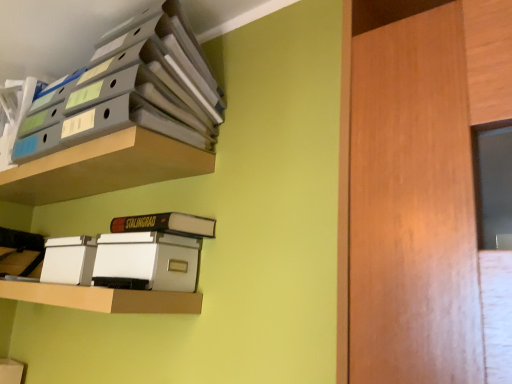
Question: From a real-world perspective, is matte plastic shelf at upper left, the 2th shelf viewed from the top, positioned under matte gray folders at upper left, the 1th shelf in the top-to-bottom sequence, based on gravity?

Choices:
 (A) no
 (B) yes

Answer: (B)

Question: Is matte plastic shelf at upper left, the 2th shelf viewed from the top, thinner than matte gray folders at upper left, the 1th shelf in the top-to-bottom sequence?

Choices:
 (A) yes
 (B) no

Answer: (A)

Question: Considering the relative positions of matte plastic shelf at upper left, which ranks as the second shelf in bottom-to-top order, and matte gray folders at upper left, the third shelf from the bottom, in the image provided, is matte plastic shelf at upper left, which ranks as the second shelf in bottom-to-top order, to the right of matte gray folders at upper left, the third shelf from the bottom, from the viewer's perspective?

Choices:
 (A) yes
 (B) no

Answer: (B)

Question: Is matte plastic shelf at upper left, the 2th shelf viewed from the top, to the left of matte gray folders at upper left, the 1th shelf in the top-to-bottom sequence, from the viewer's perspective?

Choices:
 (A) yes
 (B) no

Answer: (A)

Question: Is matte plastic shelf at upper left, which ranks as the second shelf in bottom-to-top order, positioned before matte gray folders at upper left, the third shelf from the bottom?

Choices:
 (A) no
 (B) yes

Answer: (A)

Question: Considering the positions of hardcover book at center and white cardboard shelf at lower center, marked as the 1th shelf in a bottom-to-top arrangement, in the image, is hardcover book at center bigger or smaller than white cardboard shelf at lower center, marked as the 1th shelf in a bottom-to-top arrangement,?

Choices:
 (A) big
 (B) small

Answer: (B)

Question: From the image's perspective, is hardcover book at center above or below white cardboard shelf at lower center, marked as the 1th shelf in a bottom-to-top arrangement?

Choices:
 (A) below
 (B) above

Answer: (B)

Question: From a real-world perspective, is hardcover book at center above or below white cardboard shelf at lower center, marked as the 1th shelf in a bottom-to-top arrangement?

Choices:
 (A) below
 (B) above

Answer: (B)

Question: Is point (182, 216) closer or farther from the camera than point (7, 294)?

Choices:
 (A) closer
 (B) farther

Answer: (A)

Question: Considering their positions, is white cardboard shelf at lower center, marked as the 1th shelf in a bottom-to-top arrangement, located in front of or behind matte plastic shelf at upper left, the 2th shelf viewed from the top?

Choices:
 (A) behind
 (B) front

Answer: (B)

Question: Is white cardboard shelf at lower center, acting as the 3th shelf starting from the top, to the left or to the right of matte plastic shelf at upper left, which ranks as the second shelf in bottom-to-top order, in the image?

Choices:
 (A) right
 (B) left

Answer: (B)

Question: From the image's perspective, is white cardboard shelf at lower center, marked as the 1th shelf in a bottom-to-top arrangement, above or below matte plastic shelf at upper left, which ranks as the second shelf in bottom-to-top order?

Choices:
 (A) below
 (B) above

Answer: (A)

Question: From a real-world perspective, relative to matte plastic shelf at upper left, which ranks as the second shelf in bottom-to-top order, is white cardboard shelf at lower center, acting as the 3th shelf starting from the top, vertically above or below?

Choices:
 (A) below
 (B) above

Answer: (A)

Question: Considering their positions, is matte plastic shelf at upper left, which ranks as the second shelf in bottom-to-top order, located in front of or behind white plastic storage box at lower left?

Choices:
 (A) front
 (B) behind

Answer: (A)

Question: From their relative heights in the image, would you say matte plastic shelf at upper left, the 2th shelf viewed from the top, is taller or shorter than white plastic storage box at lower left?

Choices:
 (A) short
 (B) tall

Answer: (A)